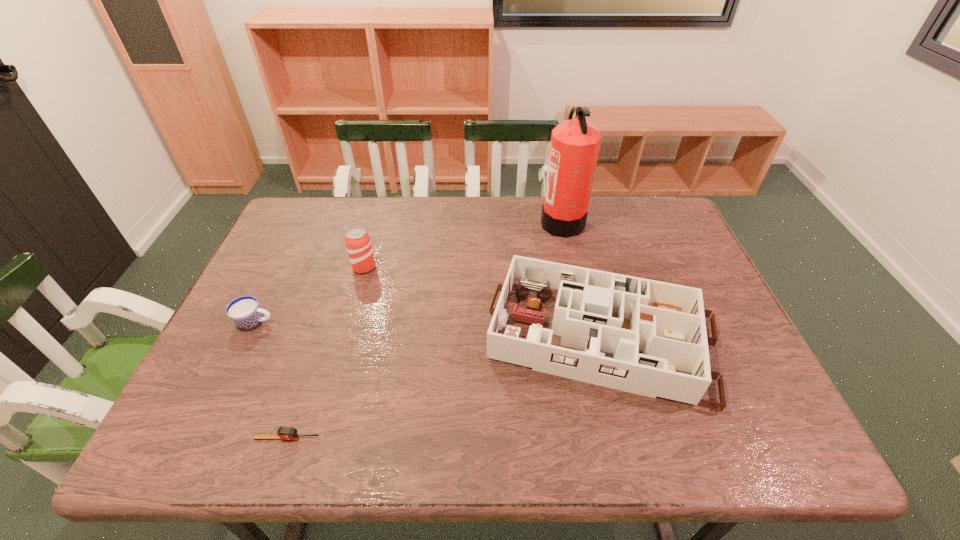
Where is `vacant space that satisfies the following two spatial constraints: 1. on the front side of the fire extinguisher; 2. on the front side of the beer can`? vacant space that satisfies the following two spatial constraints: 1. on the front side of the fire extinguisher; 2. on the front side of the beer can is located at coordinates (572, 267).

Find the location of a particular element. The height and width of the screenshot is (540, 960). free spot that satisfies the following two spatial constraints: 1. on the front side of the fire extinguisher; 2. on the front side of the second tallest object is located at coordinates (572, 267).

Identify the location of vacant space that satisfies the following two spatial constraints: 1. on the back side of the third shortest object; 2. on the side of the cup with the handle. (598, 322).

Find the location of a particular element. Image resolution: width=960 pixels, height=540 pixels. blank space that satisfies the following two spatial constraints: 1. on the side of the third tallest object with the handle; 2. on the left side of the cup is located at coordinates [247, 339].

This screenshot has width=960, height=540. Identify the location of free location that satisfies the following two spatial constraints: 1. on the front side of the farthest object; 2. on the front side of the fourth shortest object. (572, 267).

Locate an element on the screen. free space in the image that satisfies the following two spatial constraints: 1. on the side of the fourth tallest object with the handle; 2. on the back side of the dollhouse is located at coordinates click(x=247, y=339).

Image resolution: width=960 pixels, height=540 pixels. Identify the location of free location that satisfies the following two spatial constraints: 1. on the side of the leftmost object with the handle; 2. on the back side of the nearest object. (200, 438).

Image resolution: width=960 pixels, height=540 pixels. Identify the location of vacant area that satisfies the following two spatial constraints: 1. on the side of the tape measure with the handle; 2. on the left side of the leftmost object. (200, 438).